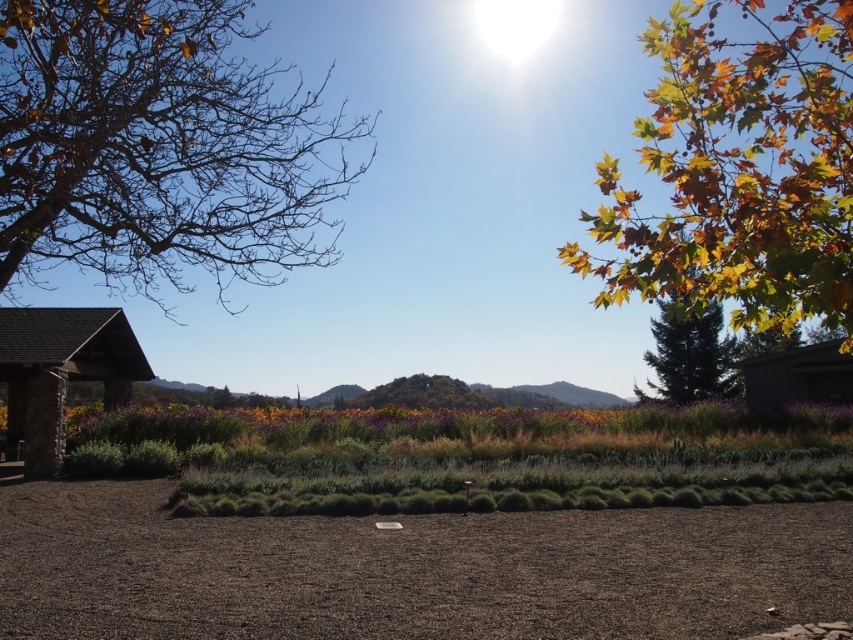
Image resolution: width=853 pixels, height=640 pixels. What do you see at coordinates (410, 570) in the screenshot?
I see `dark brown gravel at lower center` at bounding box center [410, 570].

Does dark brown gravel at lower center have a lesser height compared to stone/wooden hut at left?

Indeed, dark brown gravel at lower center has a lesser height compared to stone/wooden hut at left.

At what (x,y) coordinates should I click in order to perform the action: click on dark brown gravel at lower center. Please return your answer as a coordinate pair (x, y). The image size is (853, 640). Looking at the image, I should click on (410, 570).

You are a GUI agent. You are given a task and a screenshot of the screen. Output one action in this format:
    pyautogui.click(x=<x>, y=<y>)
    Task: Click on the dark brown gravel at lower center
    This screenshot has height=640, width=853.
    Given the screenshot: What is the action you would take?
    pyautogui.click(x=410, y=570)

Is golden leafy tree at upper right to the right of green matte tree at right from the viewer's perspective?

Yes, golden leafy tree at upper right is to the right of green matte tree at right.

Who is more distant from viewer, (778, 115) or (675, 317)?

Positioned behind is point (675, 317).

Find the location of `golden leafy tree at upper right`. golden leafy tree at upper right is located at coordinates pyautogui.click(x=740, y=170).

How distant is green matte tree at right from dark brown wood hut at right?

green matte tree at right and dark brown wood hut at right are 6.76 meters apart from each other.

Does green matte tree at right have a lesser width compared to dark brown wood hut at right?

Incorrect, green matte tree at right's width is not less than dark brown wood hut at right's.

Locate an element on the screen. green matte tree at right is located at coordinates (689, 355).

Locate an element on the screen. The image size is (853, 640). green matte tree at right is located at coordinates (689, 355).